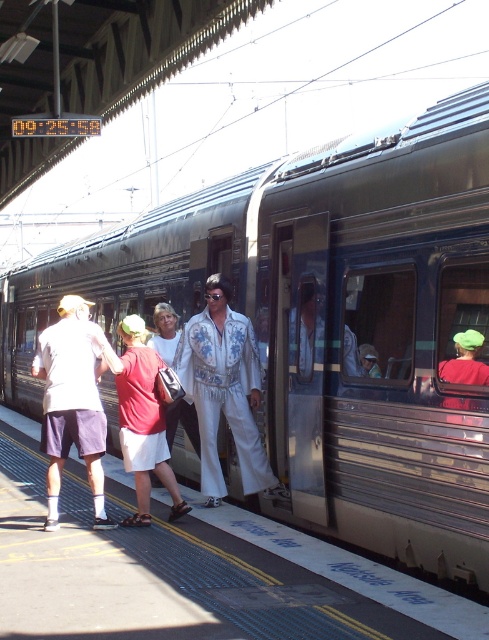
Question: Does matte white shirt at left appear on the left side of red cotton shirt at center?

Choices:
 (A) yes
 (B) no

Answer: (A)

Question: Which object is closer to the camera taking this photo?

Choices:
 (A) matte white shirt at left
 (B) red cotton shirt at center
 (C) white satin suit at center

Answer: (A)

Question: Which object is the farthest from the matte white shirt at left?

Choices:
 (A) white satin suit at center
 (B) red cotton shirt at center

Answer: (A)

Question: Can you confirm if white satin suit at center is thinner than red cotton shirt at center?

Choices:
 (A) yes
 (B) no

Answer: (B)

Question: Does white satin suit at center appear on the left side of matte white shirt at left?

Choices:
 (A) no
 (B) yes

Answer: (A)

Question: Which point is farther to the camera?

Choices:
 (A) (183, 348)
 (B) (82, 394)

Answer: (A)